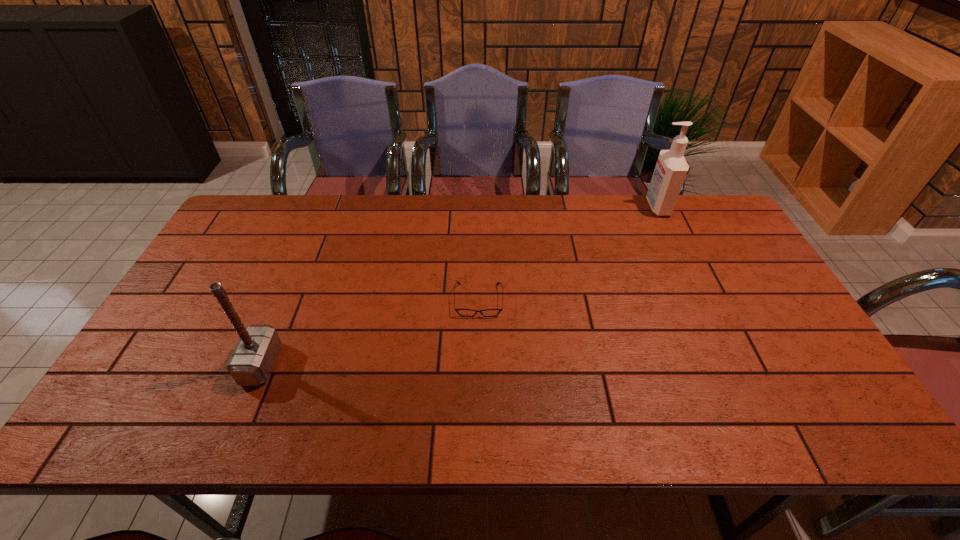
Where is `free space between the second farthest object and the farthest object`? The width and height of the screenshot is (960, 540). free space between the second farthest object and the farthest object is located at coordinates (568, 253).

The width and height of the screenshot is (960, 540). What are the coordinates of `empty space between the cleansing agent and the leftmost object` in the screenshot? It's located at (459, 286).

Find the location of a particular element. The width and height of the screenshot is (960, 540). free spot between the second object from right to left and the leftmost object is located at coordinates tap(370, 332).

I want to click on free space between the leftmost object and the rightmost object, so click(x=459, y=286).

This screenshot has width=960, height=540. Find the location of `vacant area that lies between the rightmost object and the nearest object`. vacant area that lies between the rightmost object and the nearest object is located at coordinates (459, 286).

The height and width of the screenshot is (540, 960). In order to click on free spot between the cleansing agent and the shortest object in this screenshot , I will do `click(568, 253)`.

Identify the location of vacant point located between the rightmost object and the second object from left to right. The image size is (960, 540). (568, 253).

You are a GUI agent. You are given a task and a screenshot of the screen. Output one action in this format:
    pyautogui.click(x=<x>, y=<y>)
    Task: Click on the vacant area that lies between the farthest object and the second farthest object
    This screenshot has width=960, height=540.
    Given the screenshot: What is the action you would take?
    pyautogui.click(x=568, y=253)

Locate which object ranks second in proximity to the rightmost object. Please provide its 2D coordinates. Your answer should be formatted as a tuple, i.e. [(x, y)], where the tuple contains the x and y coordinates of a point satisfying the conditions above.

[(251, 362)]

The height and width of the screenshot is (540, 960). What are the coordinates of `the closest object relative to the nearest object` in the screenshot? It's located at (462, 312).